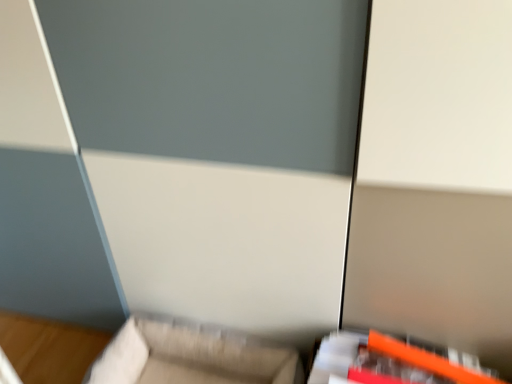
What is the approximate height of orange plastic ruler at lower right, which ranks as the first furniture in right-to-left order?

2.39 inches.

Describe the element at coordinates (390, 362) in the screenshot. I see `orange plastic ruler at lower right, acting as the second furniture starting from the left` at that location.

Where is `orange plastic ruler at lower right, acting as the second furniture starting from the left`? orange plastic ruler at lower right, acting as the second furniture starting from the left is located at coordinates click(x=390, y=362).

At what (x,y) coordinates should I click in order to perform the action: click on beige fabric couch at lower center, placed as the first furniture when sorted from left to right. Please return your answer as a coordinate pair (x, y). Looking at the image, I should click on (189, 358).

Describe the element at coordinates (189, 358) in the screenshot. I see `beige fabric couch at lower center, the 2th furniture viewed from the right` at that location.

Identify the location of orange plastic ruler at lower right, which ranks as the first furniture in right-to-left order. The width and height of the screenshot is (512, 384). (390, 362).

Which object is positioned more to the left, beige fabric couch at lower center, placed as the first furniture when sorted from left to right, or orange plastic ruler at lower right, which ranks as the first furniture in right-to-left order?

From the viewer's perspective, beige fabric couch at lower center, placed as the first furniture when sorted from left to right, appears more on the left side.

Is beige fabric couch at lower center, placed as the first furniture when sorted from left to right, in front of or behind orange plastic ruler at lower right, acting as the second furniture starting from the left, in the image?

Visually, beige fabric couch at lower center, placed as the first furniture when sorted from left to right, is located behind orange plastic ruler at lower right, acting as the second furniture starting from the left.

Which is closer to the camera, (128, 339) or (478, 375)?

Clearly, point (128, 339) is more distant from the camera than point (478, 375).

From the image's perspective, does beige fabric couch at lower center, placed as the first furniture when sorted from left to right, appear lower than orange plastic ruler at lower right, acting as the second furniture starting from the left?

Indeed, from the image's perspective, beige fabric couch at lower center, placed as the first furniture when sorted from left to right, is shown beneath orange plastic ruler at lower right, acting as the second furniture starting from the left.

From a real-world perspective, between beige fabric couch at lower center, placed as the first furniture when sorted from left to right, and orange plastic ruler at lower right, acting as the second furniture starting from the left, who is vertically lower?

beige fabric couch at lower center, placed as the first furniture when sorted from left to right, is physically lower.

Can you confirm if beige fabric couch at lower center, the 2th furniture viewed from the right, is thinner than orange plastic ruler at lower right, which ranks as the first furniture in right-to-left order?

No.

Can you confirm if beige fabric couch at lower center, placed as the first furniture when sorted from left to right, is taller than orange plastic ruler at lower right, which ranks as the first furniture in right-to-left order?

Correct, beige fabric couch at lower center, placed as the first furniture when sorted from left to right, is much taller as orange plastic ruler at lower right, which ranks as the first furniture in right-to-left order.

In terms of size, does beige fabric couch at lower center, the 2th furniture viewed from the right, appear bigger or smaller than orange plastic ruler at lower right, acting as the second furniture starting from the left?

Considering their sizes, beige fabric couch at lower center, the 2th furniture viewed from the right, takes up more space than orange plastic ruler at lower right, acting as the second furniture starting from the left.

Is beige fabric couch at lower center, placed as the first furniture when sorted from left to right, situated inside orange plastic ruler at lower right, acting as the second furniture starting from the left, or outside?

beige fabric couch at lower center, placed as the first furniture when sorted from left to right, cannot be found inside orange plastic ruler at lower right, acting as the second furniture starting from the left.

Are beige fabric couch at lower center, the 2th furniture viewed from the right, and orange plastic ruler at lower right, which ranks as the first furniture in right-to-left order, beside each other?

There is a gap between beige fabric couch at lower center, the 2th furniture viewed from the right, and orange plastic ruler at lower right, which ranks as the first furniture in right-to-left order.

Does beige fabric couch at lower center, the 2th furniture viewed from the right, turn towards orange plastic ruler at lower right, which ranks as the first furniture in right-to-left order?

No.

How different are the orientations of beige fabric couch at lower center, placed as the first furniture when sorted from left to right, and orange plastic ruler at lower right, which ranks as the first furniture in right-to-left order, in degrees?

8.35 degrees.

Measure the distance between beige fabric couch at lower center, the 2th furniture viewed from the right, and orange plastic ruler at lower right, acting as the second furniture starting from the left.

A distance of 12.07 inches exists between beige fabric couch at lower center, the 2th furniture viewed from the right, and orange plastic ruler at lower right, acting as the second furniture starting from the left.

This screenshot has height=384, width=512. What are the coordinates of `furniture to the right of beige fabric couch at lower center, the 2th furniture viewed from the right` in the screenshot? It's located at (390, 362).

In the image, is orange plastic ruler at lower right, which ranks as the first furniture in right-to-left order, on the left side or the right side of beige fabric couch at lower center, placed as the first furniture when sorted from left to right?

Clearly, orange plastic ruler at lower right, which ranks as the first furniture in right-to-left order, is on the right of beige fabric couch at lower center, placed as the first furniture when sorted from left to right, in the image.

Is the position of orange plastic ruler at lower right, acting as the second furniture starting from the left, more distant than that of beige fabric couch at lower center, the 2th furniture viewed from the right?

No, orange plastic ruler at lower right, acting as the second furniture starting from the left, is in front of beige fabric couch at lower center, the 2th furniture viewed from the right.

Which is behind, point (342, 350) or point (211, 377)?

Point (211, 377)

From the image's perspective, does orange plastic ruler at lower right, which ranks as the first furniture in right-to-left order, appear higher than beige fabric couch at lower center, placed as the first furniture when sorted from left to right?

Yes, from the image's perspective, orange plastic ruler at lower right, which ranks as the first furniture in right-to-left order, is above beige fabric couch at lower center, placed as the first furniture when sorted from left to right.

From a real-world perspective, which object rests below the other?

beige fabric couch at lower center, the 2th furniture viewed from the right, from a real-world perspective.

Between orange plastic ruler at lower right, acting as the second furniture starting from the left, and beige fabric couch at lower center, placed as the first furniture when sorted from left to right, which one has larger width?

With larger width is beige fabric couch at lower center, placed as the first furniture when sorted from left to right.

Considering the relative sizes of orange plastic ruler at lower right, which ranks as the first furniture in right-to-left order, and beige fabric couch at lower center, placed as the first furniture when sorted from left to right, in the image provided, is orange plastic ruler at lower right, which ranks as the first furniture in right-to-left order, taller than beige fabric couch at lower center, placed as the first furniture when sorted from left to right,?

Incorrect, the height of orange plastic ruler at lower right, which ranks as the first furniture in right-to-left order, is not larger of that of beige fabric couch at lower center, placed as the first furniture when sorted from left to right.

Is orange plastic ruler at lower right, acting as the second furniture starting from the left, bigger or smaller than beige fabric couch at lower center, the 2th furniture viewed from the right?

In the image, orange plastic ruler at lower right, acting as the second furniture starting from the left, appears to be smaller than beige fabric couch at lower center, the 2th furniture viewed from the right.

Is orange plastic ruler at lower right, which ranks as the first furniture in right-to-left order, completely or partially outside of beige fabric couch at lower center, placed as the first furniture when sorted from left to right?

Yes.

Is orange plastic ruler at lower right, acting as the second furniture starting from the left, directly adjacent to beige fabric couch at lower center, placed as the first furniture when sorted from left to right?

No, orange plastic ruler at lower right, acting as the second furniture starting from the left, is not making contact with beige fabric couch at lower center, placed as the first furniture when sorted from left to right.

Does orange plastic ruler at lower right, acting as the second furniture starting from the left, turn towards beige fabric couch at lower center, the 2th furniture viewed from the right?

No, orange plastic ruler at lower right, acting as the second furniture starting from the left, is not facing towards beige fabric couch at lower center, the 2th furniture viewed from the right.

Can you tell me how much orange plastic ruler at lower right, which ranks as the first furniture in right-to-left order, and beige fabric couch at lower center, the 2th furniture viewed from the right, differ in facing direction?

8.35 degrees.

Measure the distance between orange plastic ruler at lower right, which ranks as the first furniture in right-to-left order, and beige fabric couch at lower center, the 2th furniture viewed from the right.

orange plastic ruler at lower right, which ranks as the first furniture in right-to-left order, is 12.07 inches away from beige fabric couch at lower center, the 2th furniture viewed from the right.

The image size is (512, 384). In the image, there is a beige fabric couch at lower center, placed as the first furniture when sorted from left to right. What are the coordinates of `furniture above it (from the image's perspective)` in the screenshot? It's located at (390, 362).

Where is `furniture behind the orange plastic ruler at lower right, which ranks as the first furniture in right-to-left order`? furniture behind the orange plastic ruler at lower right, which ranks as the first furniture in right-to-left order is located at coordinates (189, 358).

The image size is (512, 384). What are the coordinates of `furniture below the orange plastic ruler at lower right, which ranks as the first furniture in right-to-left order (from the image's perspective)` in the screenshot? It's located at (189, 358).